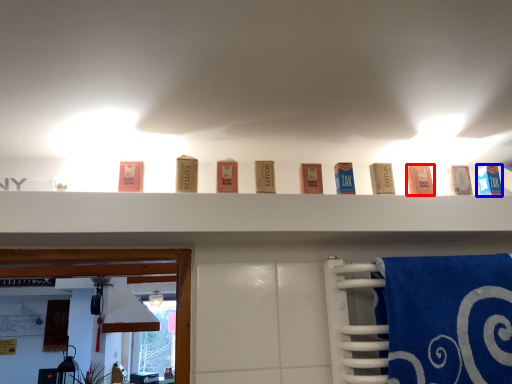
Question: Which point is further to the camera, product (highlighted by a red box) or product (highlighted by a blue box)?

Choices:
 (A) product
 (B) product

Answer: (B)